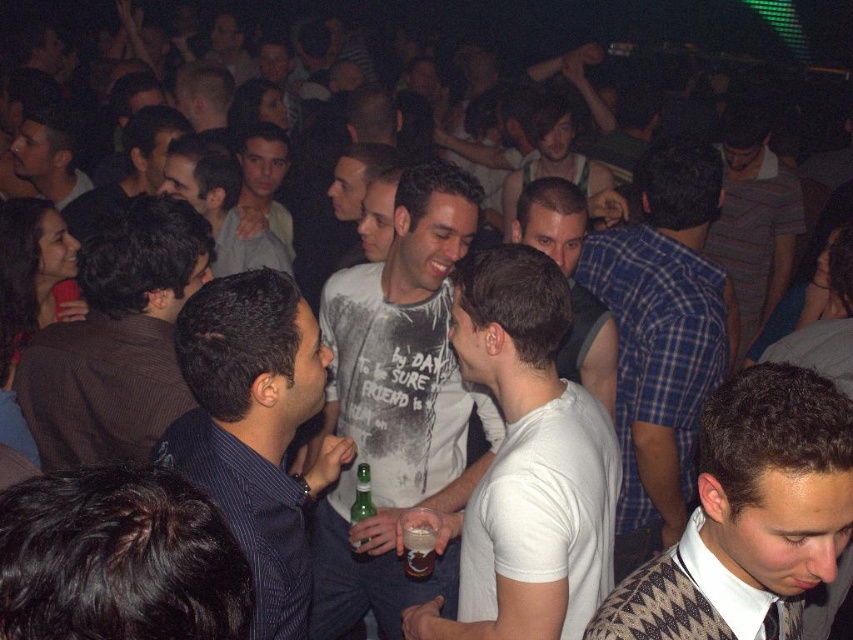
Question: Is white cotton t-shirt at center wider than green glass bottle at center?

Choices:
 (A) no
 (B) yes

Answer: (B)

Question: Does dark blue shirt at center appear on the left side of translucent glass beer at center?

Choices:
 (A) yes
 (B) no

Answer: (A)

Question: Which of the following is the farthest from the observer?

Choices:
 (A) green glass bottle at center
 (B) dark blue shirt at center
 (C) translucent glass beer at center
 (D) blue plaid shirt at center

Answer: (B)

Question: Which point is closer to the camera?

Choices:
 (A) (33, 141)
 (B) (172, 113)
 (C) (367, 380)

Answer: (C)

Question: Is brown textured shirt at left in front of translucent glass beer at center?

Choices:
 (A) yes
 (B) no

Answer: (B)

Question: Which point appears closest to the camera in this image?

Choices:
 (A) (318, 595)
 (B) (51, 128)
 (C) (788, 248)
 (D) (180, 125)

Answer: (A)